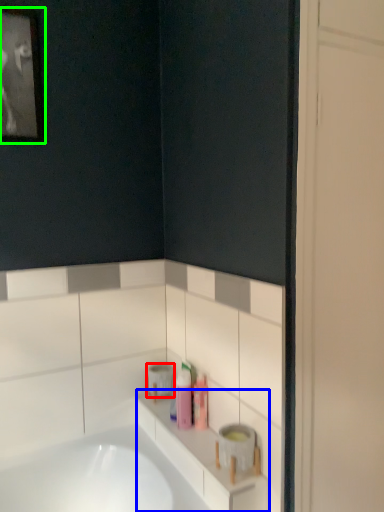
Question: Which object is the farthest from toilet paper (highlighted by a red box)? Choose among these: counter top (highlighted by a blue box) or picture frame (highlighted by a green box).

Choices:
 (A) counter top
 (B) picture frame

Answer: (B)